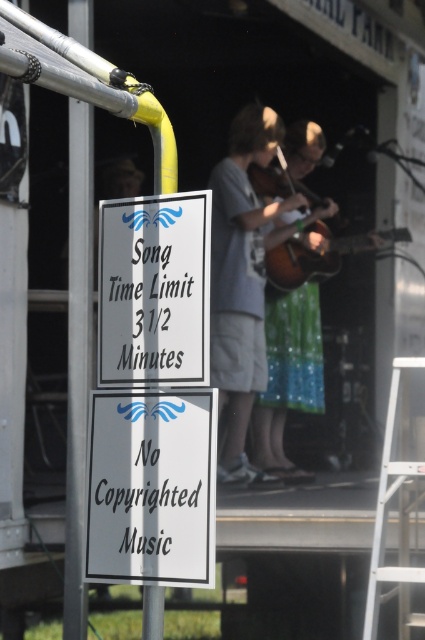
You are a photographer adjusting your camera settings to focus on two points in the image. The points are labeled as point (183, 333) and point (224, 305). Which point should you focus on first if you want to ensure the closer one is sharp?

Point (183, 333) is closer to the camera than point (224, 305), so you should focus on point (183, 333) first to ensure it is sharp.

You are standing at the center of the scene. You want to reach both the white paper sign at center and the brown wooden guitar at center. Which object is closer to you?

The white paper sign at center and the brown wooden guitar at center are both at the center, so they are equidistant from you. However, according to the description, the white paper sign at center is 20.05 feet away from the brown wooden guitar at center, meaning they are positioned at the same central point but separated by that distance. This might indicate they are at different depths, so you need to clarify their actual positions.

You are a performer at a music event and you want to check the rules. You see a white paper sign at center and a gray cotton shirt at upper center. Which object is smaller in size?

The white paper sign at center has a smaller size compared to the gray cotton shirt at upper center, so the white paper sign at center is smaller.